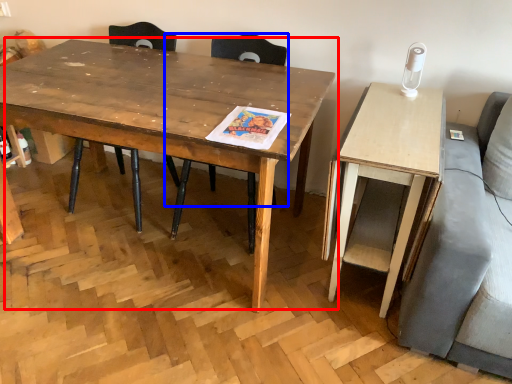
Question: Which of the following is the farthest to the observer, coffee table (highlighted by a red box) or chair (highlighted by a blue box)?

Choices:
 (A) coffee table
 (B) chair

Answer: (B)